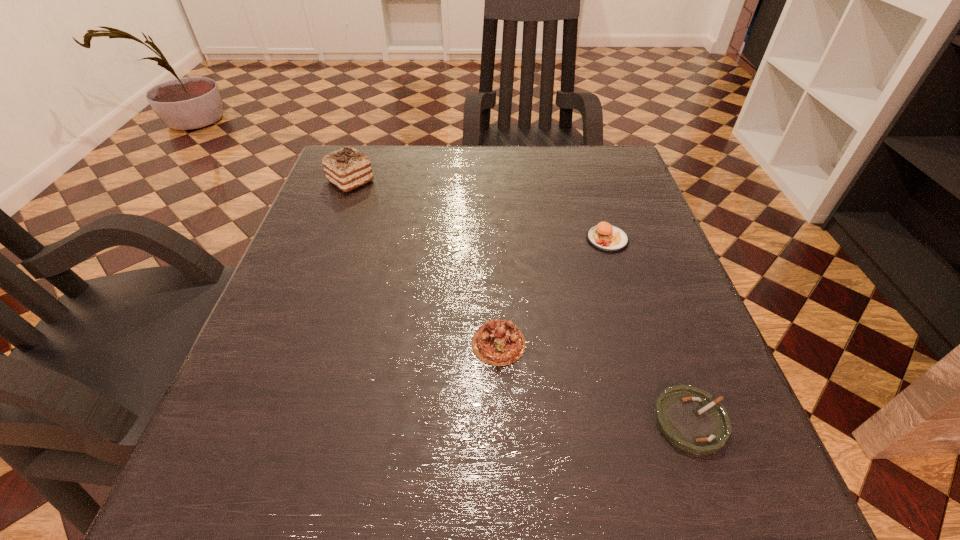
What are the coordinates of `the tallest object` in the screenshot? It's located at (347, 168).

Locate an element on the screen. the farthest object is located at coordinates (347, 168).

The height and width of the screenshot is (540, 960). Find the location of `patty`. patty is located at coordinates (605, 237).

Identify the location of the third farthest object. The height and width of the screenshot is (540, 960). (499, 342).

Where is `the nearer chocolate cake`? the nearer chocolate cake is located at coordinates (499, 342).

The height and width of the screenshot is (540, 960). In order to click on the shortest object in this screenshot , I will do `click(690, 419)`.

Find the location of `the nearest object`. the nearest object is located at coordinates (690, 419).

You are a GUI agent. You are given a task and a screenshot of the screen. Output one action in this format:
    pyautogui.click(x=<x>, y=<y>)
    Task: Click on the vacant region located 0.250m on the front of the farther chocolate cake
    This screenshot has width=960, height=540.
    Given the screenshot: What is the action you would take?
    pyautogui.click(x=317, y=271)

The image size is (960, 540). In order to click on vacant space located on the back of the third nearest object in this screenshot , I will do `click(583, 161)`.

Where is `free region located on the left of the shorter chocolate cake`? This screenshot has height=540, width=960. free region located on the left of the shorter chocolate cake is located at coordinates (286, 343).